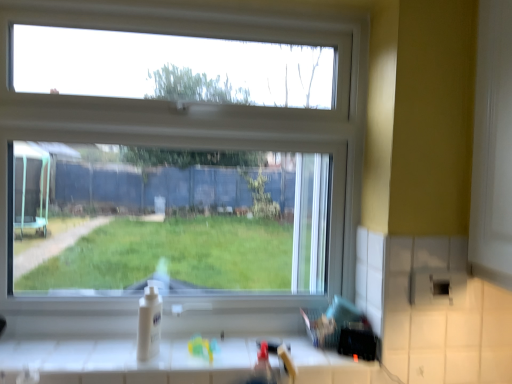
Question: Is white glossy sink at lower center taller or shorter than clear glass window at center?

Choices:
 (A) tall
 (B) short

Answer: (B)

Question: Considering the positions of white glossy sink at lower center and clear glass window at center in the image, is white glossy sink at lower center bigger or smaller than clear glass window at center?

Choices:
 (A) big
 (B) small

Answer: (B)

Question: Which object is the closest to the white glossy sink at lower center?

Choices:
 (A) white glossy counter at lower center
 (B) clear glass window at center

Answer: (A)

Question: Estimate the real-world distances between objects in this image. Which object is farther from the clear glass window at center?

Choices:
 (A) white glossy counter at lower center
 (B) white glossy sink at lower center

Answer: (B)